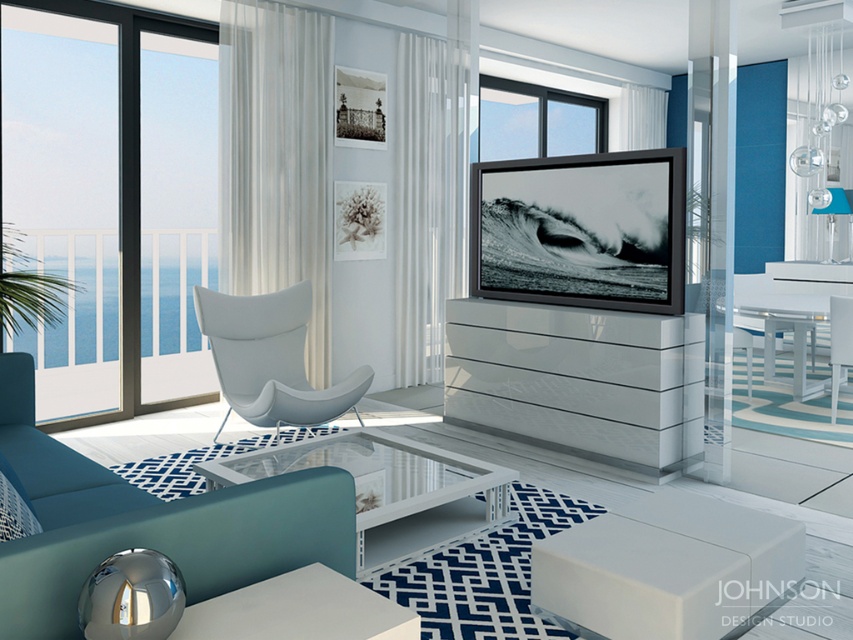
Question: Which object appears farthest from the camera in this image?

Choices:
 (A) transparent glass coffee table at center
 (B) black glass window at upper center

Answer: (B)

Question: Which point is farther to the camera?

Choices:
 (A) (265, 413)
 (B) (842, 349)
 (C) (53, 33)
 (D) (537, 150)

Answer: (D)

Question: Is matte blue couch at lower left behind white glossy chair at center?

Choices:
 (A) yes
 (B) no

Answer: (B)

Question: Is white glossy stool at lower center wider than white glossy chair at center?

Choices:
 (A) no
 (B) yes

Answer: (B)

Question: Where is transparent glass coffee table at center located in relation to black glass window at upper center in the image?

Choices:
 (A) above
 (B) below

Answer: (B)

Question: Estimate the real-world distances between objects in this image. Which object is farther from the white glossy stool at lower center?

Choices:
 (A) transparent glass coffee table at center
 (B) white glossy chair at center
 (C) black glass window at upper center

Answer: (C)